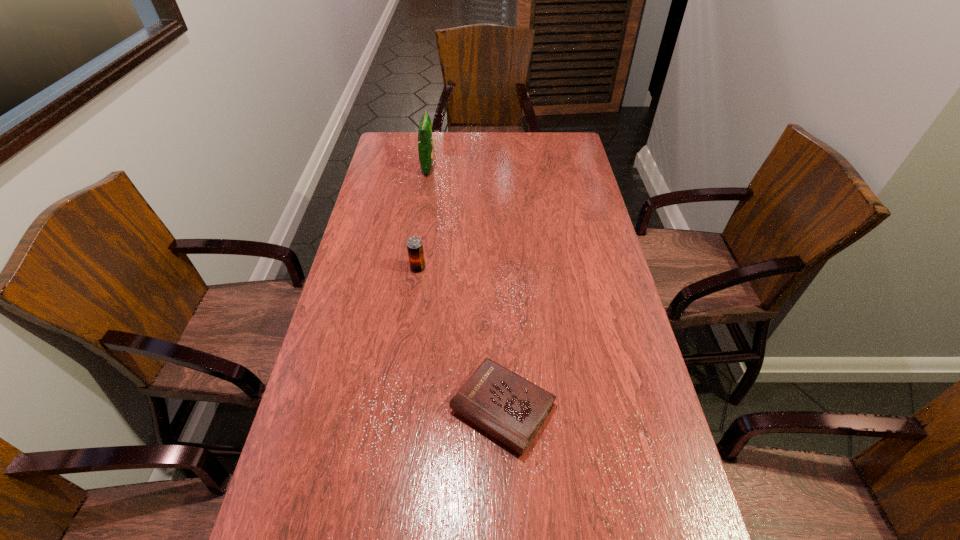
Locate an element on the screen. Image resolution: width=960 pixels, height=540 pixels. crisp (potato chip) is located at coordinates (425, 138).

This screenshot has height=540, width=960. I want to click on the farthest object, so click(x=425, y=138).

This screenshot has height=540, width=960. Find the location of `the second nearest object`. the second nearest object is located at coordinates (414, 244).

Locate an element on the screen. This screenshot has height=540, width=960. beer can is located at coordinates (414, 244).

You are a GUI agent. You are given a task and a screenshot of the screen. Output one action in this format:
    pyautogui.click(x=<x>, y=<y>)
    Task: Click on the hardback book
    Image resolution: width=960 pixels, height=540 pixels.
    Given the screenshot: What is the action you would take?
    pyautogui.click(x=510, y=408)

At what (x,y) coordinates should I click in order to perform the action: click on the nearest object. Please return your answer as a coordinate pair (x, y). The width and height of the screenshot is (960, 540). Looking at the image, I should click on (510, 408).

Locate an element on the screen. Image resolution: width=960 pixels, height=540 pixels. free point located 0.100m on the front-facing side of the farthest object is located at coordinates (460, 167).

You are a GUI agent. You are given a task and a screenshot of the screen. Output one action in this format:
    pyautogui.click(x=<x>, y=<y>)
    Task: Click on the blank area located on the back of the second shortest object
    
    Given the screenshot: What is the action you would take?
    pyautogui.click(x=424, y=220)

The height and width of the screenshot is (540, 960). Find the location of `free location located on the left of the hardback book`. free location located on the left of the hardback book is located at coordinates (417, 409).

You are a GUI agent. You are given a task and a screenshot of the screen. Output one action in this format:
    pyautogui.click(x=<x>, y=<y>)
    Task: Click on the object that is at the far edge
    
    Given the screenshot: What is the action you would take?
    pyautogui.click(x=425, y=138)